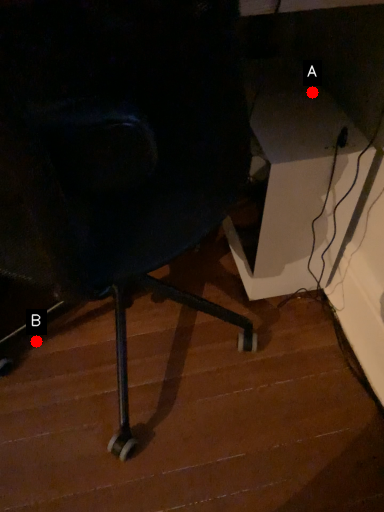
Question: Two points are circled on the image, labeled by A and B beside each circle. Which point is closer to the camera taking this photo?

Choices:
 (A) A is closer
 (B) B is closer

Answer: (A)